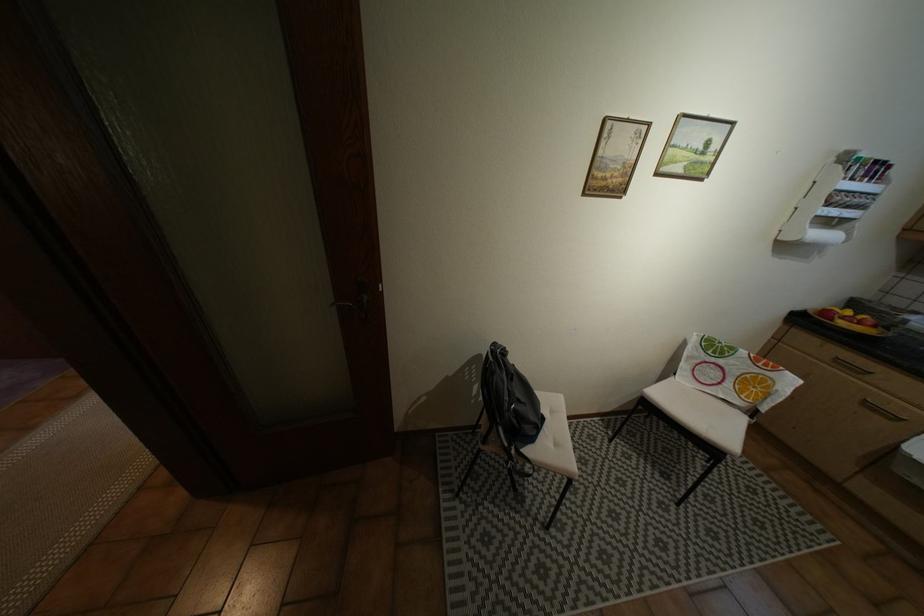
Where is `cabinet drawer handle`? cabinet drawer handle is located at coordinates (850, 366).